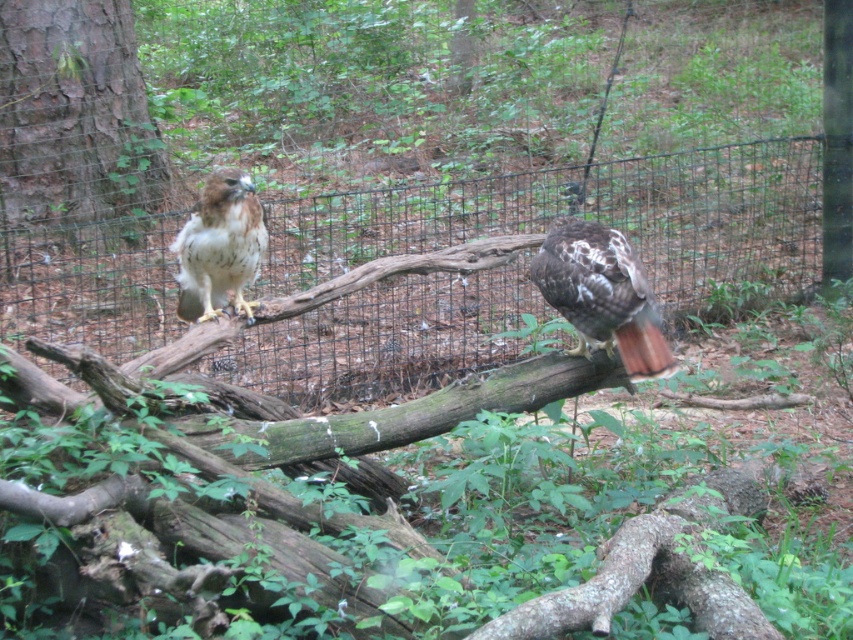
You are a birdwatcher observing the brown speckled feathers at center and the brown speckled feathers at left in the sanctuary. Which set of feathers is larger?

The brown speckled feathers at center is bigger than the brown speckled feathers at left.

You are a bird trying to fly from the black wire mesh at center to the brown rough bark tree at left. Which object is shorter, allowing you to land more easily?

The black wire mesh at center is not as tall as the brown rough bark tree at left, so it is shorter and easier to land on.